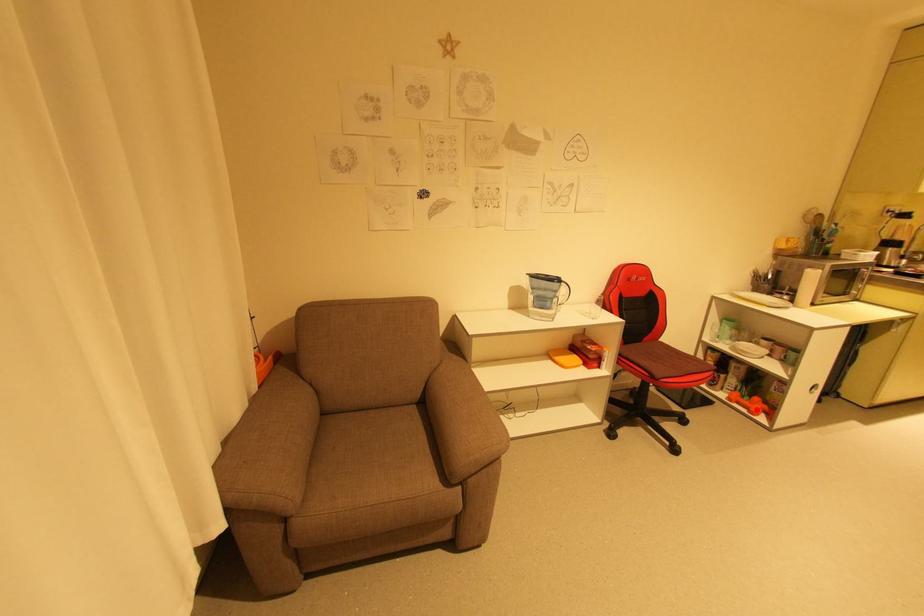
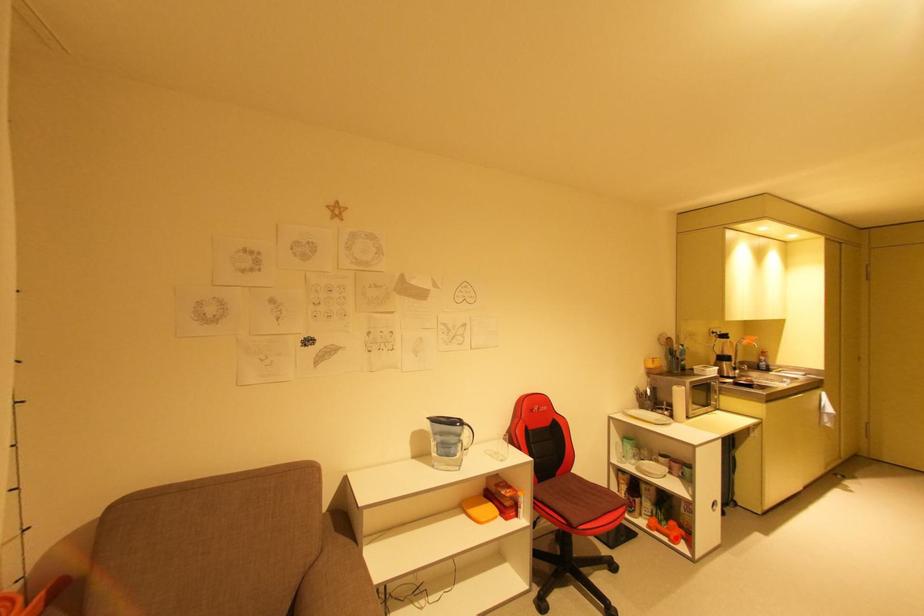
I am providing you with two images of the same scene from different viewpoints. A red point is marked on the first image and another point is marked on the second image. Is the marked point in image1 the same physical position as the marked point in image2?

Yes